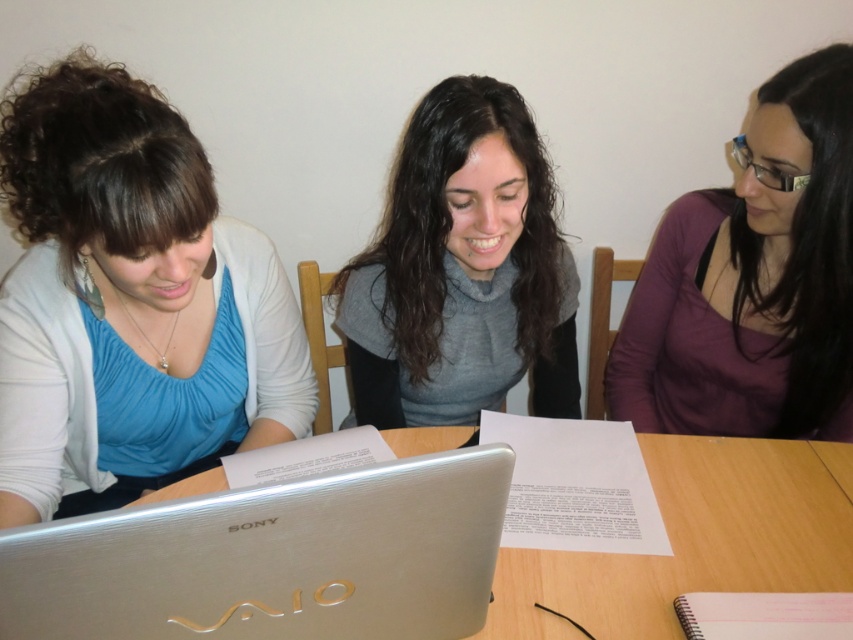
Can you confirm if matte blue blouse at left is positioned above purple matte shirt at center?

No, matte blue blouse at left is not above purple matte shirt at center.

Can you confirm if matte blue blouse at left is wider than purple matte shirt at center?

Yes, matte blue blouse at left is wider than purple matte shirt at center.

Does point (70, 243) lie in front of point (712, 205)?

Yes, point (70, 243) is in front of point (712, 205).

You are a GUI agent. You are given a task and a screenshot of the screen. Output one action in this format:
    pyautogui.click(x=<x>, y=<y>)
    Task: Click on the matte blue blouse at left
    
    Given the screenshot: What is the action you would take?
    pyautogui.click(x=129, y=301)

Does purple matte shirt at center have a smaller size compared to gray soft sweater at center?

Correct, purple matte shirt at center occupies less space than gray soft sweater at center.

You are a GUI agent. You are given a task and a screenshot of the screen. Output one action in this format:
    pyautogui.click(x=<x>, y=<y>)
    Task: Click on the purple matte shirt at center
    Image resolution: width=853 pixels, height=640 pixels.
    Given the screenshot: What is the action you would take?
    pyautogui.click(x=753, y=280)

Can you confirm if silver metallic laptop at center is positioned above purple matte shirt at center?

No, silver metallic laptop at center is not above purple matte shirt at center.

Who is more forward, (502, 520) or (773, 234)?

Point (502, 520) is in front.

Image resolution: width=853 pixels, height=640 pixels. In order to click on silver metallic laptop at center in this screenshot , I will do `click(273, 557)`.